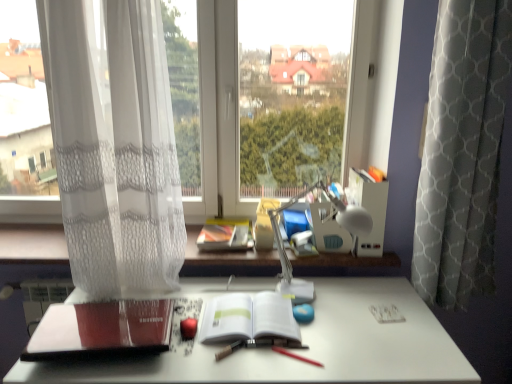
Locate an element on the screen. The image size is (512, 384). vacant space in front of smooth red crayon at center is located at coordinates (301, 376).